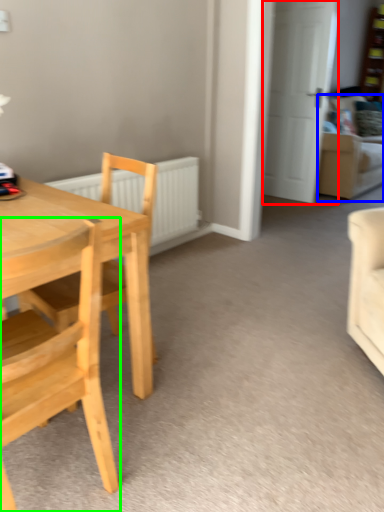
Question: Which is nearer to the door (highlighted by a red box)? couch (highlighted by a blue box) or chair (highlighted by a green box).

Choices:
 (A) couch
 (B) chair

Answer: (A)